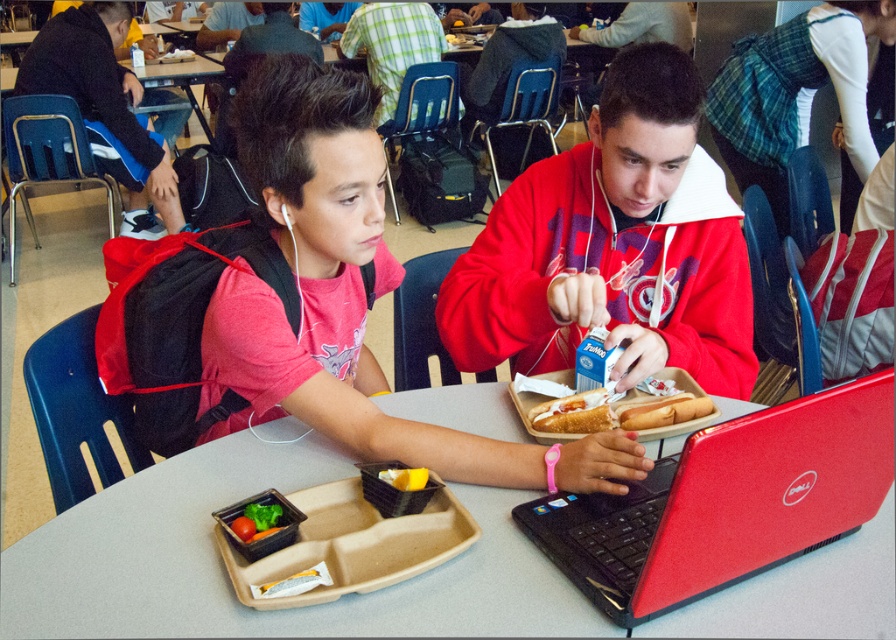
Question: Which point is farther from the camera taking this photo?

Choices:
 (A) coord(576,403)
 (B) coord(274,515)
 (C) coord(392,45)

Answer: (C)

Question: Observing the image, what is the correct spatial positioning of matte black backpack at left in reference to green leafy vegetables at center?

Choices:
 (A) left
 (B) right

Answer: (A)

Question: Can you confirm if matte red backpack at left is bigger than white earphone at center?

Choices:
 (A) yes
 (B) no

Answer: (A)

Question: Which point is closer to the camera taking this photo?

Choices:
 (A) (583, 424)
 (B) (260, 534)
 (C) (283, 211)
 (D) (858, 508)

Answer: (B)

Question: Which of the following is the closest to the observer?

Choices:
 (A) (565, 545)
 (B) (254, 536)
 (C) (553, 426)
 (D) (190, 529)

Answer: (B)

Question: Is red plastic laptop at center smaller than plaid shirt at upper center?

Choices:
 (A) no
 (B) yes

Answer: (B)